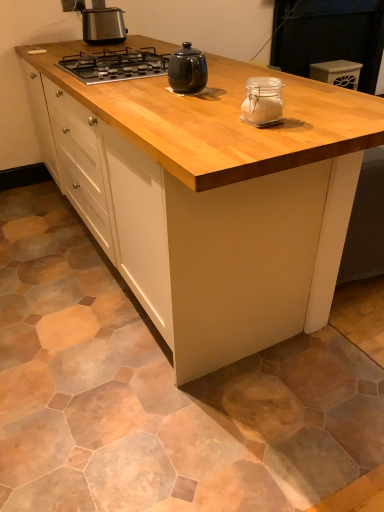
Image resolution: width=384 pixels, height=512 pixels. I want to click on spots to the right of glossy ceramic mug at upper center, the 2th kitchen appliance from the front, so click(233, 87).